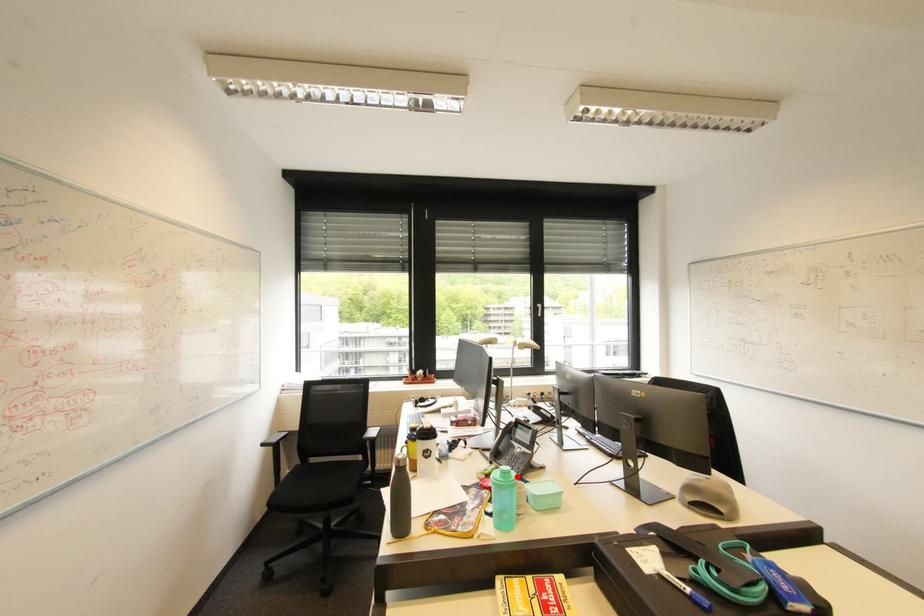
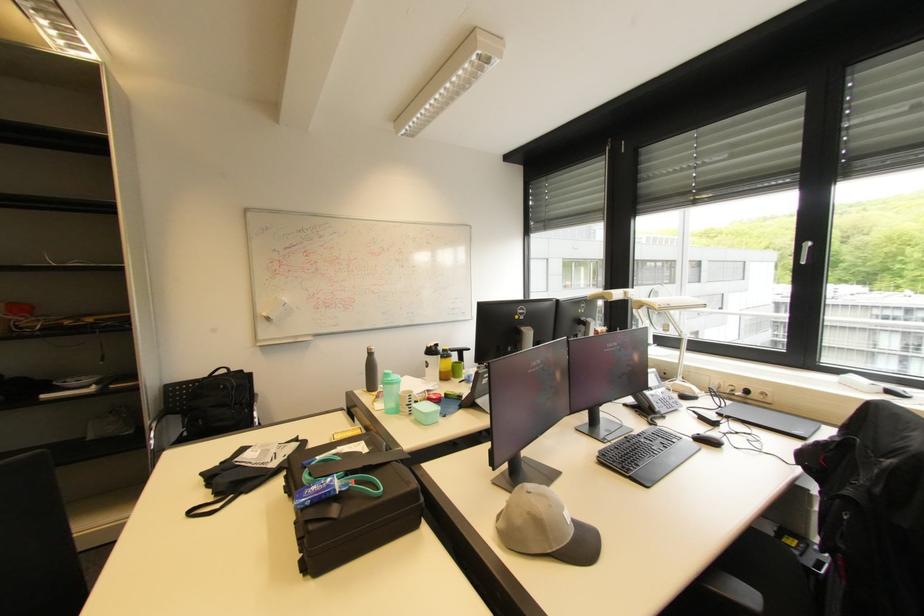
Question: I am providing you with two images of the same scene from different viewpoints. In image1, a red point is highlighted. Considering the same 3D point in image2, which of the following is correct?

Choices:
 (A) It is closer
 (B) It is farther

Answer: (B)